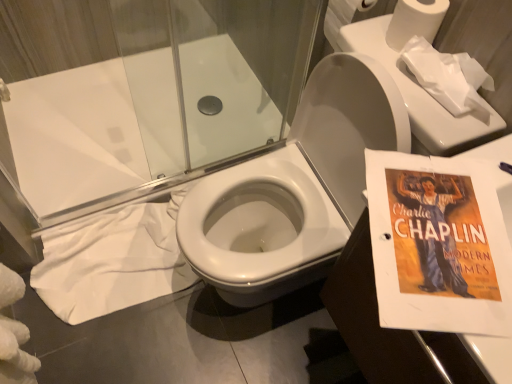
Locate an element on the screen. free space behind white fabric at lower left is located at coordinates (122, 164).